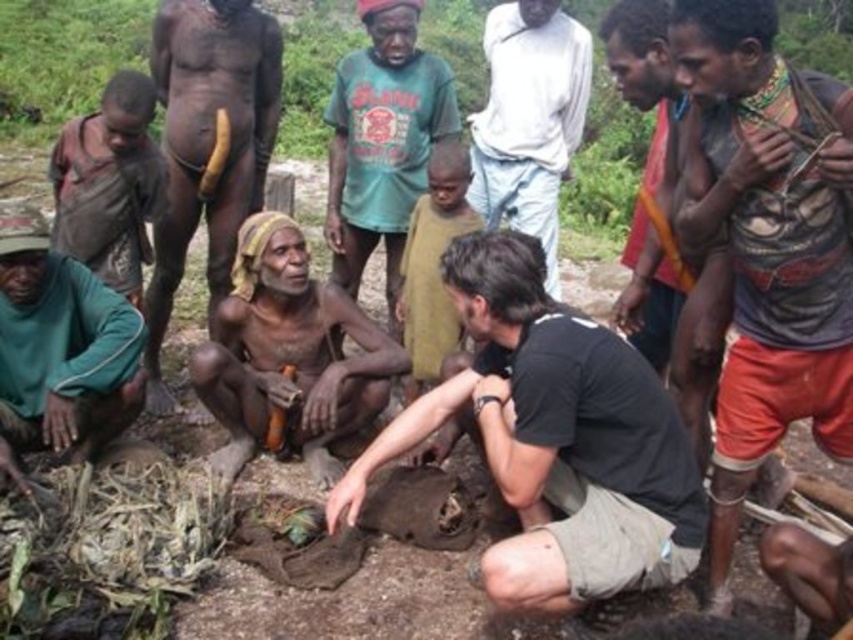
You are a photographer trying to capture a candid shot of the two individuals at the center of the scene. To ensure both subjects are in frame, should you position yourself to the left or right of the black cotton shirt at center and brown rough skin at center?

Since the black cotton shirt at center is positioned on the right side of brown rough skin at center, you should position yourself to the left of both subjects to ensure both are in frame.

You are an observer standing at the edge of the scene. You notice the black cotton shirt at center and the green fabric pants at lower left. Which object is closer to the ground?

The black cotton shirt at center is positioned under green fabric pants at lower left, so it is closer to the ground.